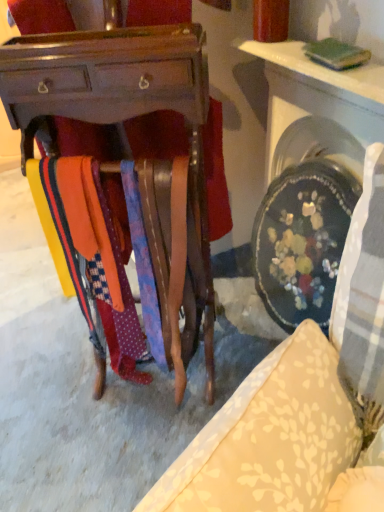
In the scene shown: Measure the distance between point [299,57] and camera.

They are 1.10 meters apart.

Find the location of a particular element. The image size is (384, 512). wooden tie rack at center is located at coordinates (300, 398).

I want to click on orange fabric at center, so click(85, 291).

Is white glossy table at upper right oriented away from wooden desk at center?

That's not correct — white glossy table at upper right is not looking away from wooden desk at center.

Which is more to the right, white glossy table at upper right or wooden desk at center?

white glossy table at upper right.

Is white glossy table at upper right bigger than wooden desk at center?

Incorrect, white glossy table at upper right is not larger than wooden desk at center.

Looking at this image, is polka dot fabric tie at center positioned with its back to wooden desk at center?

Yes, polka dot fabric tie at center's orientation is away from wooden desk at center.

From the image's perspective, would you say polka dot fabric tie at center is positioned over wooden desk at center?

Actually, polka dot fabric tie at center appears below wooden desk at center in the image.

How many degrees apart are the facing directions of polka dot fabric tie at center and wooden desk at center?

There is a 0.656-degree angle between the facing directions of polka dot fabric tie at center and wooden desk at center.

Looking at this image, measure the distance from orange fabric at center to white glossy table at upper right.

The distance of orange fabric at center from white glossy table at upper right is 76.93 centimeters.

Are orange fabric at center and white glossy table at upper right making contact?

orange fabric at center and white glossy table at upper right are clearly separated.

From the image's perspective, which object appears higher, orange fabric at center or white glossy table at upper right?

white glossy table at upper right.

From a real-world perspective, is orange fabric at center located higher than white glossy table at upper right?

No, from a real-world perspective, orange fabric at center is not on top of white glossy table at upper right.

Is white glossy table at upper right in contact with wooden tie rack at center?

No, white glossy table at upper right is not touching wooden tie rack at center.

How much distance is there between white glossy table at upper right and wooden tie rack at center?

white glossy table at upper right is 22.90 inches from wooden tie rack at center.

Consider the image. Which object is positioned more to the right, white glossy table at upper right or wooden tie rack at center?

Positioned to the right is white glossy table at upper right.

What's the angular difference between white glossy table at upper right and wooden tie rack at center's facing directions?

The angular difference between white glossy table at upper right and wooden tie rack at center is 180 degrees.

Identify the location of furniture to the left of orange fabric at center. (300, 398).

Considering the sizes of objects wooden tie rack at center and orange fabric at center in the image provided, who is smaller, wooden tie rack at center or orange fabric at center?

orange fabric at center.

Is wooden tie rack at center looking in the opposite direction of orange fabric at center?

No, orange fabric at center is not at the back of wooden tie rack at center.

Is wooden tie rack at center wider than wooden desk at center?

Correct, the width of wooden tie rack at center exceeds that of wooden desk at center.

Can you tell me how much wooden tie rack at center and wooden desk at center differ in facing direction?

The angle between the facing direction of wooden tie rack at center and the facing direction of wooden desk at center is 123 degrees.

From the picture: Is wooden tie rack at center directly adjacent to wooden desk at center?

No, wooden tie rack at center is not with wooden desk at center.

Is wooden tie rack at center in front of or behind wooden desk at center in the image?

In the image, wooden tie rack at center appears behind wooden desk at center.

Is wooden desk at center located outside polka dot fabric tie at center?

Indeed, wooden desk at center is completely outside polka dot fabric tie at center.

There is a polka dot fabric tie at center. Identify the location of desk above it (from a real-world perspective). This screenshot has width=384, height=512. (113, 83).

From a real-world perspective, who is located lower, wooden desk at center or polka dot fabric tie at center?

polka dot fabric tie at center.

Considering the relative sizes of wooden desk at center and polka dot fabric tie at center in the image provided, is wooden desk at center smaller than polka dot fabric tie at center?

Incorrect, wooden desk at center is not smaller in size than polka dot fabric tie at center.

You are a GUI agent. You are given a task and a screenshot of the screen. Output one action in this format:
    pyautogui.click(x=<x>, y=<y>)
    Task: Click on the table on the right of wooden desk at center
    
    Given the screenshot: What is the action you would take?
    pyautogui.click(x=319, y=68)

I want to click on tie behind the wooden desk at center, so click(x=143, y=264).

When comparing their distances from wooden desk at center, does orange fabric at center or wooden tie rack at center seem further?

wooden tie rack at center.

Based on their spatial positions, is polka dot fabric tie at center or white glossy table at upper right further from wooden desk at center?

white glossy table at upper right lies further to wooden desk at center than the other object.

Looking at the image, which one is located further to wooden desk at center, white glossy table at upper right or orange fabric at center?

white glossy table at upper right lies further to wooden desk at center than the other object.

Looking at the image, which one is located closer to polka dot fabric tie at center, wooden desk at center or orange fabric at center?

orange fabric at center.

Based on their spatial positions, is wooden tie rack at center or polka dot fabric tie at center further from wooden desk at center?

wooden tie rack at center.

From the image, which object appears to be farther from orange fabric at center, white glossy table at upper right or wooden desk at center?

The object further to orange fabric at center is white glossy table at upper right.

When comparing their distances from orange fabric at center, does wooden desk at center or polka dot fabric tie at center seem further?

wooden desk at center lies further to orange fabric at center than the other object.

From the image, which object appears to be farther from white glossy table at upper right, orange fabric at center or polka dot fabric tie at center?

Based on the image, orange fabric at center appears to be further to white glossy table at upper right.

Where is `desk between wooden tie rack at center and polka dot fabric tie at center from left to right`? desk between wooden tie rack at center and polka dot fabric tie at center from left to right is located at coordinates (113, 83).

Where is `fabric between wooden tie rack at center and polka dot fabric tie at center`? fabric between wooden tie rack at center and polka dot fabric tie at center is located at coordinates (85, 291).

This screenshot has height=512, width=384. I want to click on fabric located between wooden tie rack at center and white glossy table at upper right in the left-right direction, so click(x=85, y=291).

This screenshot has height=512, width=384. Identify the location of tie between wooden desk at center and orange fabric at center in the front-back direction. (143, 264).